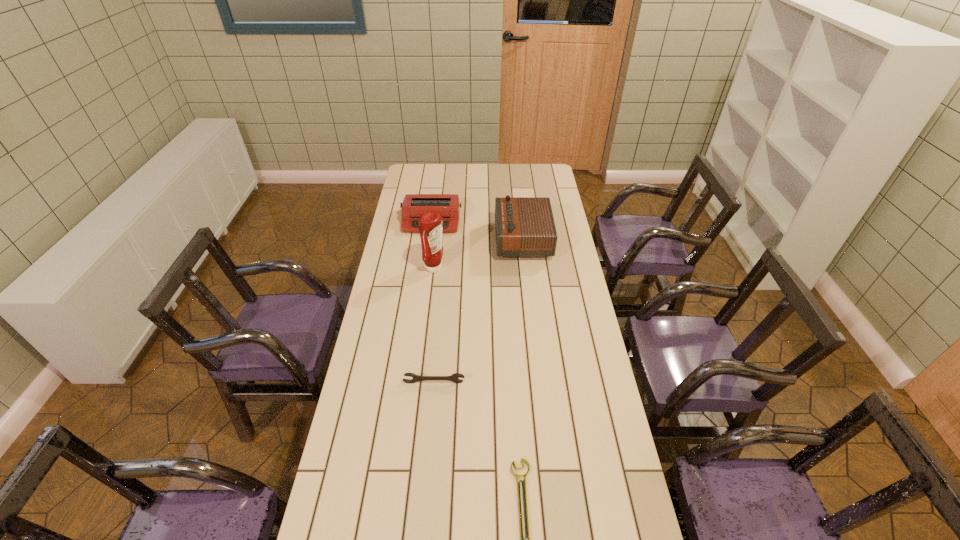
This screenshot has height=540, width=960. What are the coordinates of `condiment` in the screenshot? It's located at (430, 225).

Identify the location of the second tallest object. The width and height of the screenshot is (960, 540). pos(524,226).

Identify the location of typewriter. The width and height of the screenshot is (960, 540). (414, 206).

Find the location of `the farther wrench`. the farther wrench is located at coordinates (453, 377).

You are a GUI agent. You are given a task and a screenshot of the screen. Output one action in this format:
    pyautogui.click(x=<x>, y=<y>)
    Task: Click on the second nearest object
    This screenshot has width=960, height=540.
    Given the screenshot: What is the action you would take?
    pyautogui.click(x=453, y=377)

The width and height of the screenshot is (960, 540). I want to click on free space located on the front of the condiment, so click(428, 334).

Locate an element on the screen. free space located 0.250m on the front panel of the fourth shortest object is located at coordinates (440, 240).

The height and width of the screenshot is (540, 960). In order to click on vacant space located 0.160m on the front panel of the fourth shortest object in this screenshot , I will do `click(460, 240)`.

Where is `vacant area located 0.180m on the front panel of the fourth shortest object`? vacant area located 0.180m on the front panel of the fourth shortest object is located at coordinates (455, 240).

Identify the location of vacant space located on the typing side of the third shortest object. This screenshot has height=540, width=960. (426, 261).